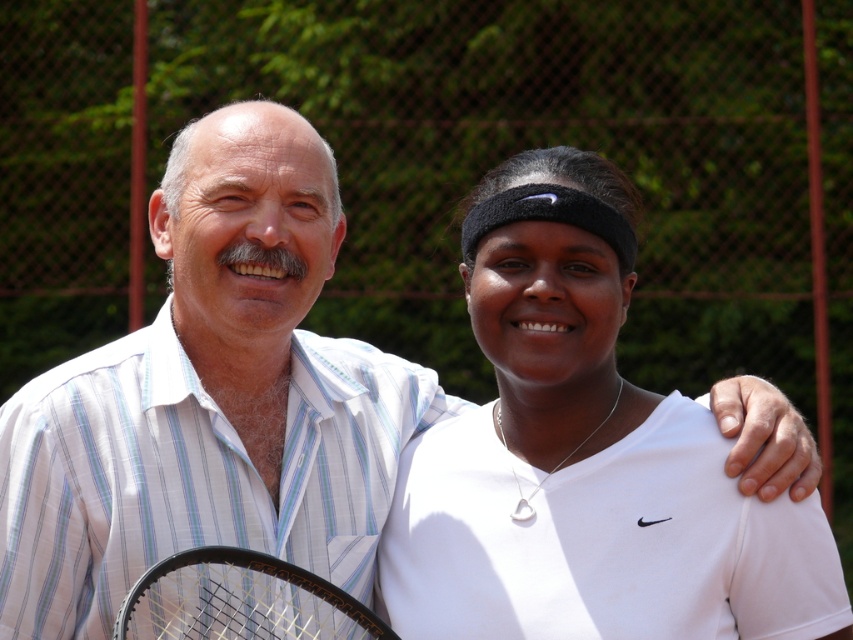
From the picture: Who is more forward, (432, 624) or (254, 630)?

Point (432, 624) is in front.

I want to click on white matte tennis racket at center, so click(x=584, y=456).

You are a GUI agent. You are given a task and a screenshot of the screen. Output one action in this format:
    pyautogui.click(x=<x>, y=<y>)
    Task: Click on the white matte tennis racket at center
    
    Given the screenshot: What is the action you would take?
    pos(584,456)